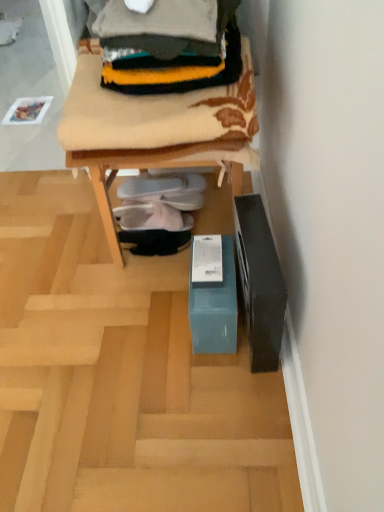
You are a GUI agent. You are given a task and a screenshot of the screen. Output one action in this format:
    pyautogui.click(x=<x>, y=<y>)
    Task: Click on the vacant space situated on the left part of white fabric shoe at center, the second footwear from the top
    The width and height of the screenshot is (384, 512).
    Given the screenshot: What is the action you would take?
    pyautogui.click(x=94, y=240)